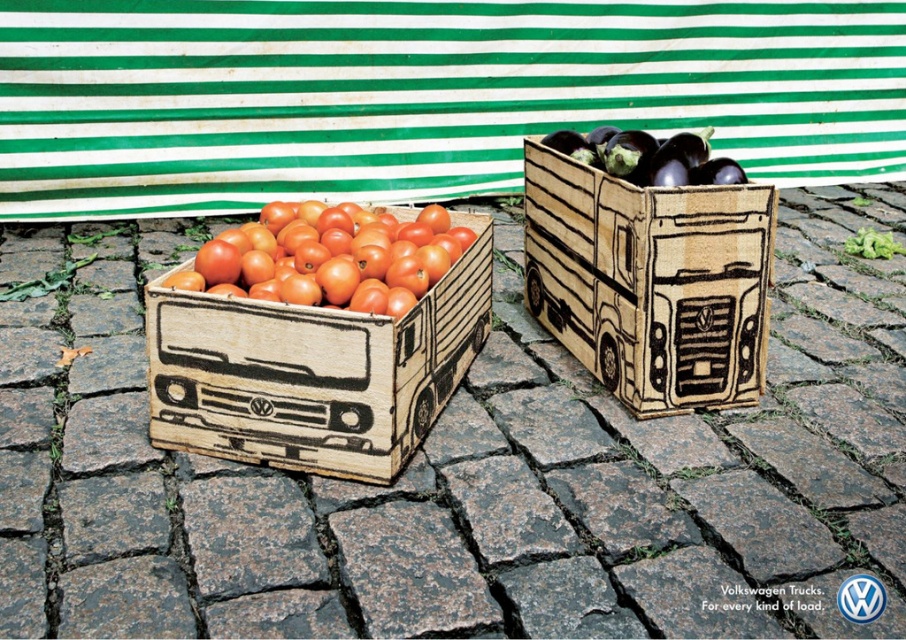
Question: Does wooden crate at center appear under shiny orange tomatoes at left?

Choices:
 (A) no
 (B) yes

Answer: (B)

Question: Can you confirm if wooden crate at center is positioned below shiny purple eggplant at upper right?

Choices:
 (A) no
 (B) yes

Answer: (B)

Question: Which of the following is the closest to the observer?

Choices:
 (A) (692, 138)
 (B) (244, 444)
 (C) (618, 275)
 (D) (436, 256)

Answer: (B)

Question: Which object appears farthest from the camera in this image?

Choices:
 (A) wooden truck at left
 (B) shiny purple eggplant at upper right
 (C) shiny orange tomatoes at left

Answer: (B)

Question: Is wooden truck at center below shiny orange tomatoes at left?

Choices:
 (A) no
 (B) yes

Answer: (B)

Question: Which point is farther to the camera?

Choices:
 (A) shiny purple eggplant at upper right
 (B) wooden truck at center

Answer: (A)